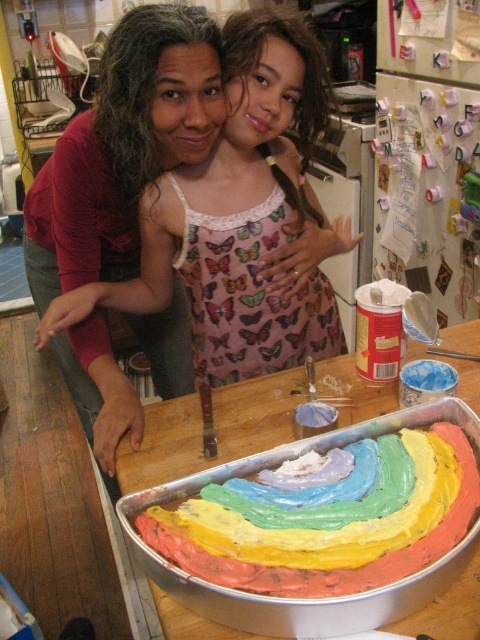
Question: Which object is closer to the camera taking this photo?

Choices:
 (A) rainbow-colored frosting at center
 (B) white creamy frosting at center
 (C) butterfly-patterned fabric at center

Answer: (A)

Question: Does butterfly-patterned fabric at center have a lesser width compared to white creamy frosting at center?

Choices:
 (A) no
 (B) yes

Answer: (A)

Question: Which of the following is the closest to the observer?

Choices:
 (A) (151, 212)
 (B) (168, 544)

Answer: (B)

Question: Which object is the farthest from the rainbow-colored frosting at center?

Choices:
 (A) butterfly-patterned fabric at center
 (B) white creamy frosting at center

Answer: (A)

Question: Is rainbow-colored frosting at center closer to the viewer compared to white creamy frosting at center?

Choices:
 (A) yes
 (B) no

Answer: (A)

Question: Can you confirm if butterfly-patterned fabric at center is thinner than rainbow-colored frosting at center?

Choices:
 (A) no
 (B) yes

Answer: (A)